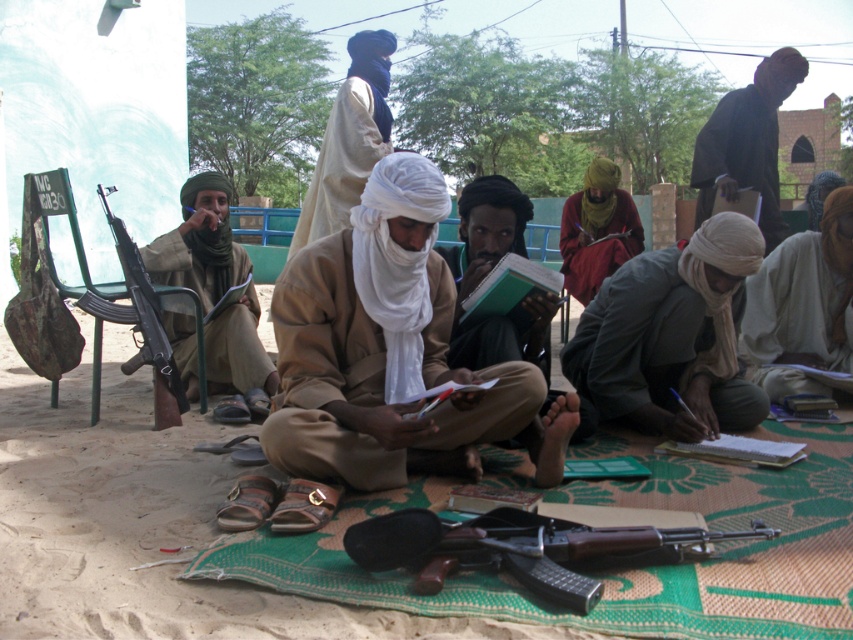
Question: Based on their relative distances, which object is farther from the beige cotton turban at center?

Choices:
 (A) matte black rifle at lower center
 (B) brown sandy ground at center
 (C) beige cotton robe at center
 (D) dark brown leather jacket at upper right

Answer: (D)

Question: Is gray cotton robe at lower right above red matte robe at center?

Choices:
 (A) no
 (B) yes

Answer: (A)

Question: Which of the following is the farthest from the observer?

Choices:
 (A) (624, 212)
 (B) (619, 378)
 (C) (469, 230)

Answer: (A)

Question: Observing the image, what is the correct spatial positioning of white cloth headscarf at center in reference to beige cotton robe at center?

Choices:
 (A) above
 (B) below

Answer: (B)

Question: Does gray cotton robe at lower right have a smaller size compared to matte black rifle at lower center?

Choices:
 (A) yes
 (B) no

Answer: (B)

Question: Estimate the real-world distances between objects in this image. Which object is closer to the white cloth headscarf at center?

Choices:
 (A) matte khaki uniform at left
 (B) gray cotton robe at lower right
 (C) dark brown leather jacket at upper right
 (D) beige cotton turban at center

Answer: (D)